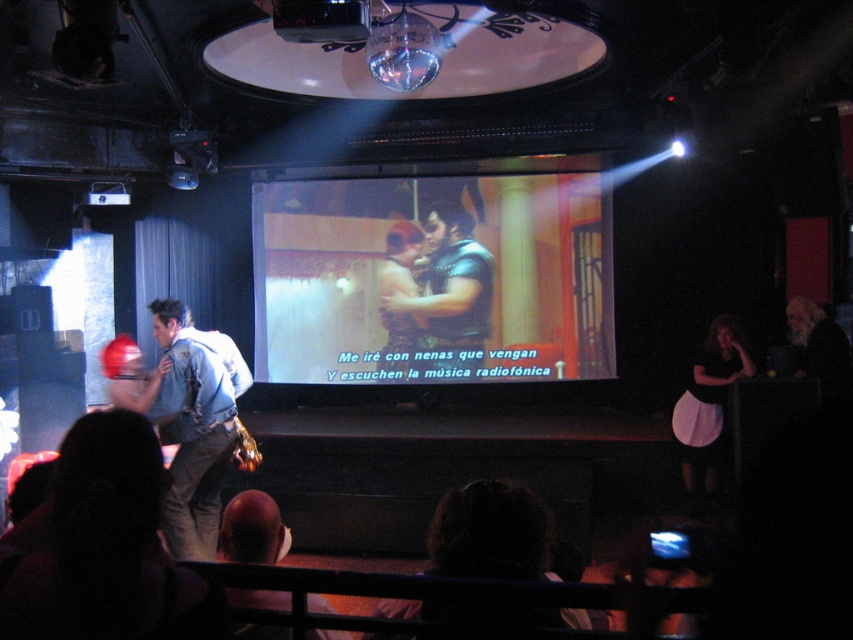
This screenshot has width=853, height=640. What do you see at coordinates (192, 422) in the screenshot?
I see `denim jacket at center` at bounding box center [192, 422].

Can you confirm if denim jacket at center is bigger than black plastic projector at upper center?

Indeed, denim jacket at center has a larger size compared to black plastic projector at upper center.

Between point (241, 365) and point (289, 3), which one is positioned behind?

The point (241, 365) is behind.

Where is `denim jacket at center`? Image resolution: width=853 pixels, height=640 pixels. denim jacket at center is located at coordinates (192, 422).

Can you confirm if matte black screen at center is positioned to the left of white cotton apron at lower right?

Indeed, matte black screen at center is positioned on the left side of white cotton apron at lower right.

Does matte black screen at center have a greater width compared to white cotton apron at lower right?

Correct, the width of matte black screen at center exceeds that of white cotton apron at lower right.

Which is behind, point (599, 280) or point (721, 392)?

The point (599, 280) is behind.

Where is `matte black screen at center`? This screenshot has width=853, height=640. matte black screen at center is located at coordinates (434, 276).

Which is more to the right, matte black dress at center or white cotton apron at lower right?

From the viewer's perspective, white cotton apron at lower right appears more on the right side.

Is matte black dress at center to the left of white cotton apron at lower right from the viewer's perspective?

Correct, you'll find matte black dress at center to the left of white cotton apron at lower right.

You are a GUI agent. You are given a task and a screenshot of the screen. Output one action in this format:
    pyautogui.click(x=<x>, y=<y>)
    Task: Click on the matte black dress at center
    The image size is (853, 640).
    Given the screenshot: What is the action you would take?
    pyautogui.click(x=450, y=291)